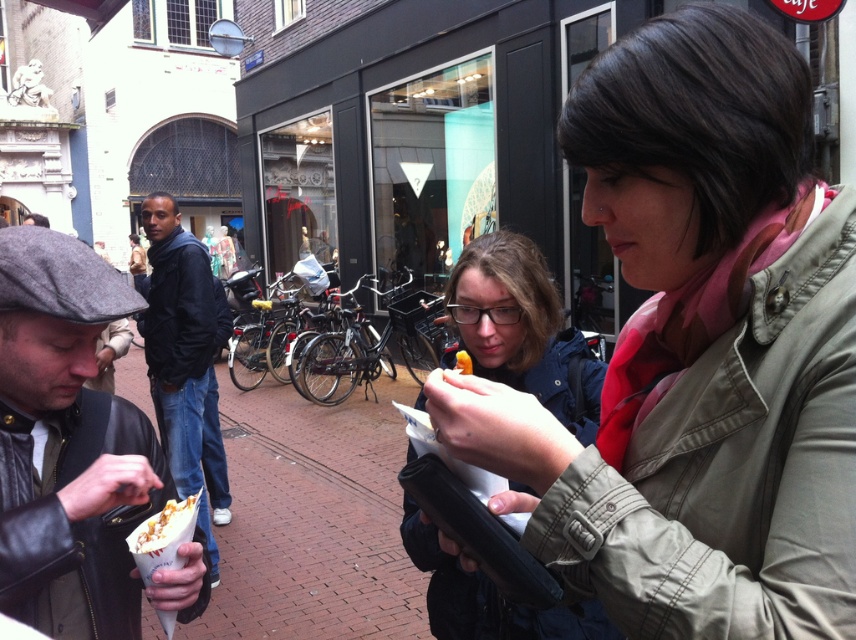
Is light brown fabric jacket at center in front of matte black jacket at center?

Yes.

Is point (607, 212) positioned after point (432, 540)?

No, it is not.

Locate an element on the screen. The image size is (856, 640). light brown fabric jacket at center is located at coordinates (697, 349).

Is matte black jacket at center above dark blue jacket at left?

Correct, matte black jacket at center is located above dark blue jacket at left.

Which of these two, matte black jacket at center or dark blue jacket at left, stands shorter?

With less height is matte black jacket at center.

The width and height of the screenshot is (856, 640). I want to click on matte black jacket at center, so click(x=522, y=330).

Is point (199, 248) positioned after point (171, 502)?

That is True.

Between point (201, 342) and point (158, 516), which one is positioned behind?

The point (201, 342) is more distant.

The height and width of the screenshot is (640, 856). In order to click on dark blue jacket at left in this screenshot , I will do `click(179, 339)`.